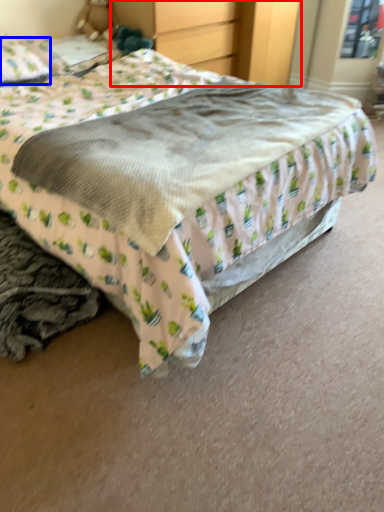
Question: Which point is closer to the camera, dresser (highlighted by a red box) or pillow (highlighted by a blue box)?

Choices:
 (A) dresser
 (B) pillow

Answer: (B)